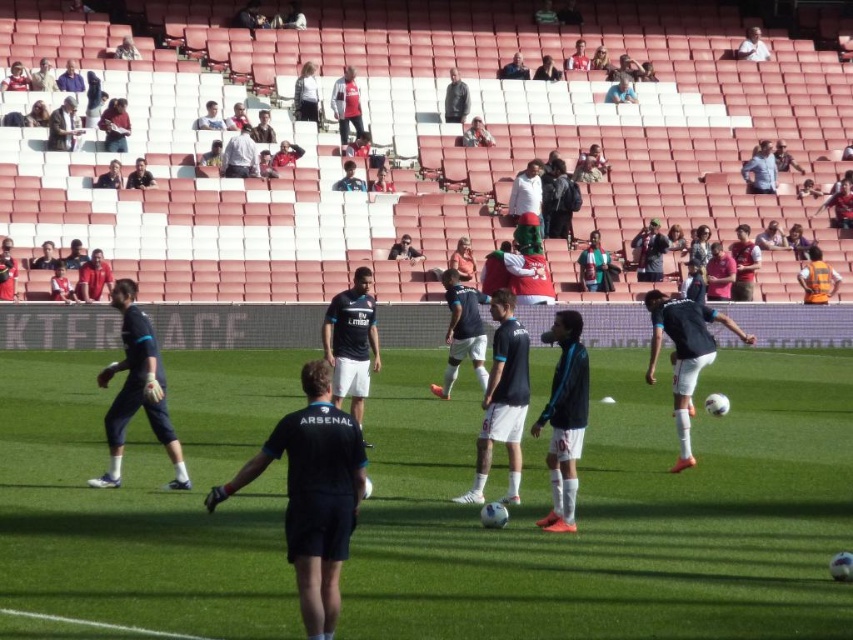
Looking at this image, can you confirm if green grass football field at center is thinner than black matte jersey at center?

No.

Who is more forward, (144, 483) or (544, 516)?

Point (544, 516) is in front.

Who is more distant from viewer, (662, 499) or (561, 477)?

Point (662, 499)

The image size is (853, 640). Find the location of `green grass football field at center`. green grass football field at center is located at coordinates (616, 513).